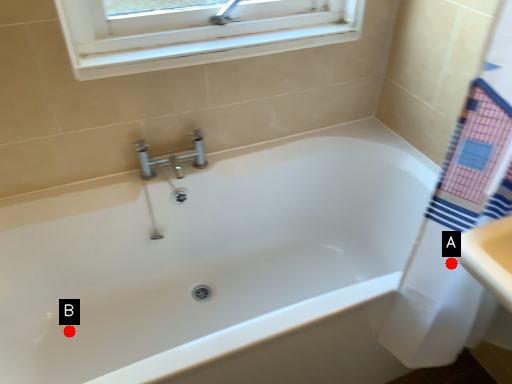
Question: Two points are circled on the image, labeled by A and B beside each circle. Which of the following is the farthest from the observer?

Choices:
 (A) A is further
 (B) B is further

Answer: (B)